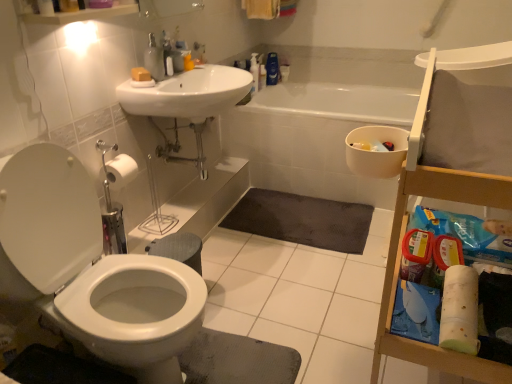
Where is `free space below dark gray textured bath mat at center (from a real-world perspective)`? This screenshot has height=384, width=512. free space below dark gray textured bath mat at center (from a real-world perspective) is located at coordinates (303, 213).